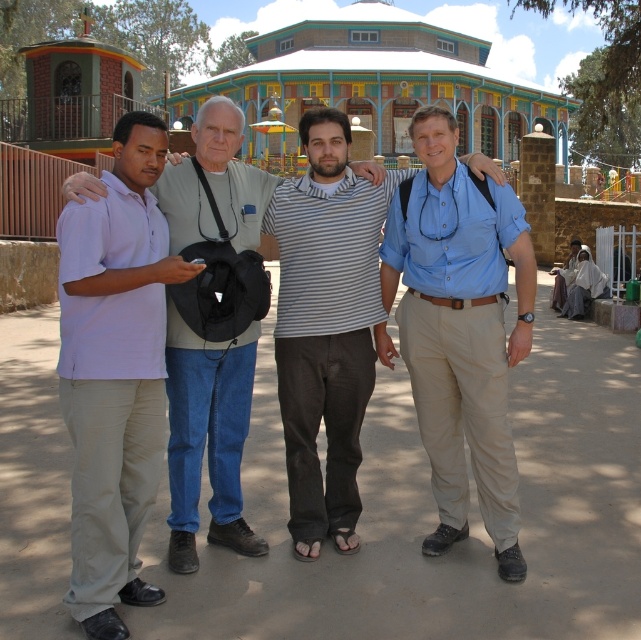
You are a photographer standing in front of the colorful building and want to take a photo of the group. You notice the light purple cotton polo shirt at left and the striped cotton shirt at center. Which shirt is positioned closer to you?

The light purple cotton polo shirt at left is closer to the viewer than the striped cotton shirt at center.